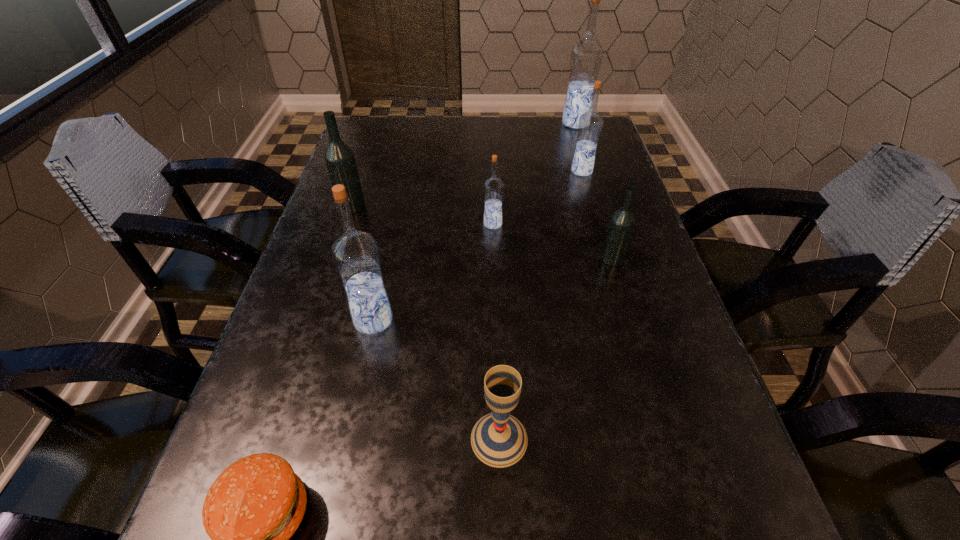
Where is `vacant space located 0.180m on the left of the gray chalice`? This screenshot has width=960, height=540. vacant space located 0.180m on the left of the gray chalice is located at coordinates (353, 439).

This screenshot has height=540, width=960. In order to click on object at the far edge in this screenshot , I will do `click(586, 56)`.

You are a GUI agent. You are given a task and a screenshot of the screen. Output one action in this format:
    pyautogui.click(x=<x>, y=<y>)
    Task: Click on the object present at the far right corner
    
    Given the screenshot: What is the action you would take?
    pyautogui.click(x=586, y=56)

You are a GUI agent. You are given a task and a screenshot of the screen. Output one action in this format:
    pyautogui.click(x=<x>, y=<y>)
    Task: Click on the vacant space at the left edge of the desktop
    The width and height of the screenshot is (960, 540).
    Given the screenshot: What is the action you would take?
    pyautogui.click(x=341, y=353)

Image resolution: width=960 pixels, height=540 pixels. Find the location of `free space at the right edge`. free space at the right edge is located at coordinates (756, 509).

You are a GUI agent. You are given a task and a screenshot of the screen. Output one action in this format:
    pyautogui.click(x=<x>, y=<y>)
    Task: Click on the free space at the far left corner of the desktop
    The image size is (960, 540).
    Given the screenshot: What is the action you would take?
    pyautogui.click(x=387, y=146)

In the image, there is a desktop. Identify the location of vacant space at the far right corner. (575, 130).

Where is `empty space between the right black vodka and the second tallest vodka`? Image resolution: width=960 pixels, height=540 pixels. empty space between the right black vodka and the second tallest vodka is located at coordinates (492, 289).

Locate an element on the screen. This screenshot has width=960, height=540. vacant area that lies between the fifth farthest vodka and the smallest blue vodka is located at coordinates (552, 241).

You are a GUI agent. You are given a task and a screenshot of the screen. Output one action in this format:
    pyautogui.click(x=<x>, y=<y>)
    Task: Click on the free space between the second nearest object and the third biggest blue vodka
    This screenshot has height=540, width=960.
    Given the screenshot: What is the action you would take?
    pyautogui.click(x=540, y=305)